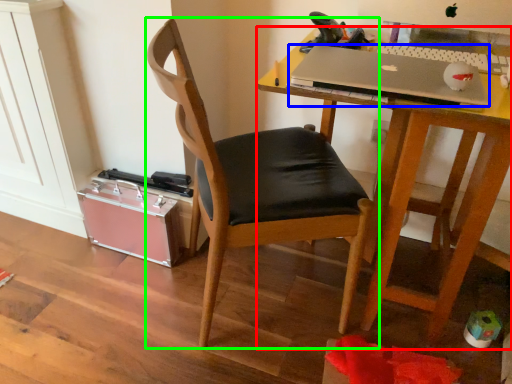
Question: Which object is the farthest from desk (highlighted by a red box)? Choose among these: laptop (highlighted by a blue box) or chair (highlighted by a green box).

Choices:
 (A) laptop
 (B) chair

Answer: (B)